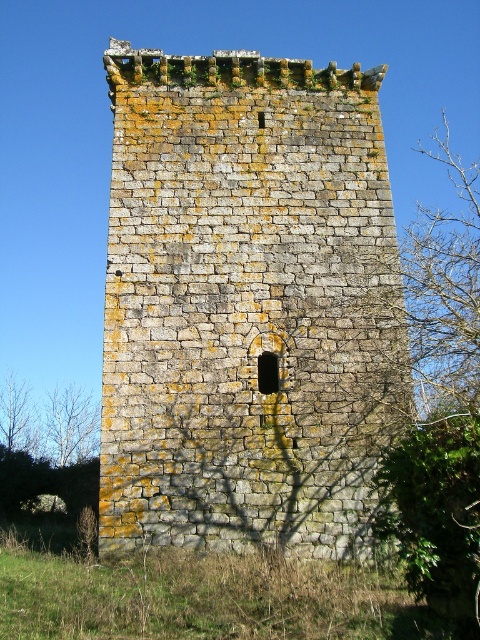
Question: Can you confirm if weathered stone tower at center is positioned below brown leafy tree at lower left?

Choices:
 (A) no
 (B) yes

Answer: (A)

Question: Which of the following is the closest to the observer?

Choices:
 (A) brown leafy tree at lower left
 (B) bare branches at left
 (C) weathered stone tower at center

Answer: (C)

Question: Considering the real-world distances, which object is closest to the weathered stone tower at center?

Choices:
 (A) brown leafy tree at lower left
 (B) bare branches at left

Answer: (B)

Question: Does bare branches at left have a larger size compared to brown leafy tree at lower left?

Choices:
 (A) yes
 (B) no

Answer: (B)

Question: Is bare branches at left in front of brown leafy tree at lower left?

Choices:
 (A) yes
 (B) no

Answer: (A)

Question: Among these points, which one is farthest from the camera?

Choices:
 (A) (27, 385)
 (B) (47, 435)

Answer: (A)